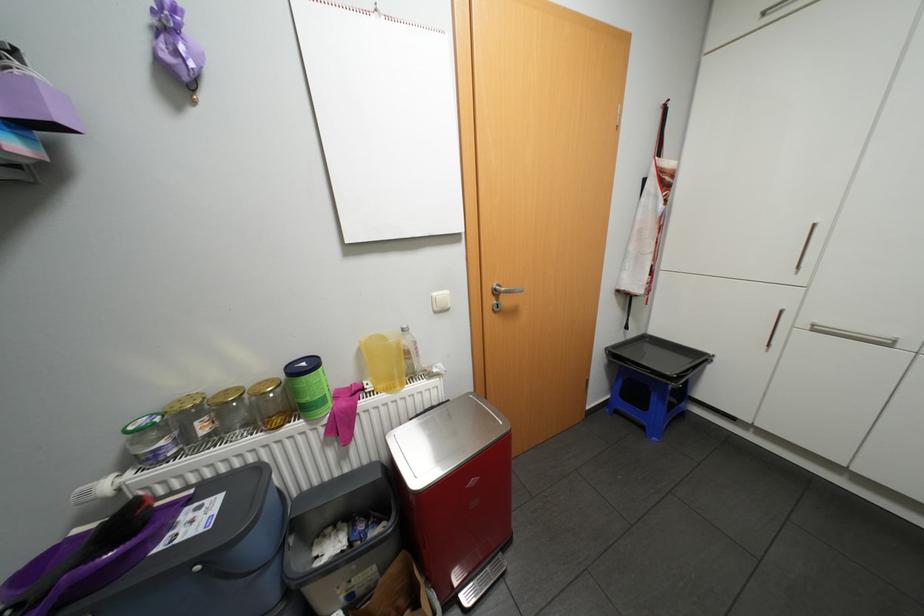
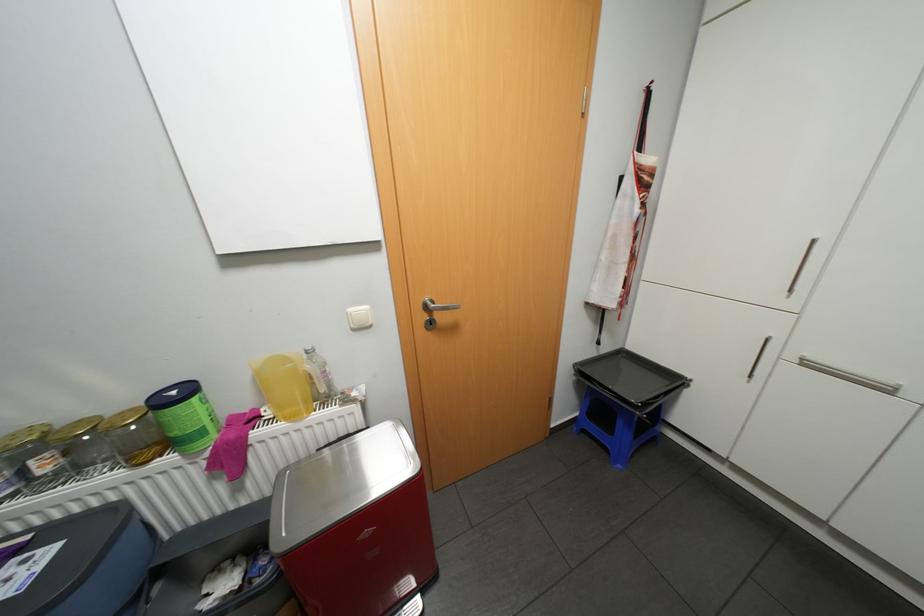
The point at (268, 382) is marked in the first image. Where is the corresponding point in the second image?

(128, 411)